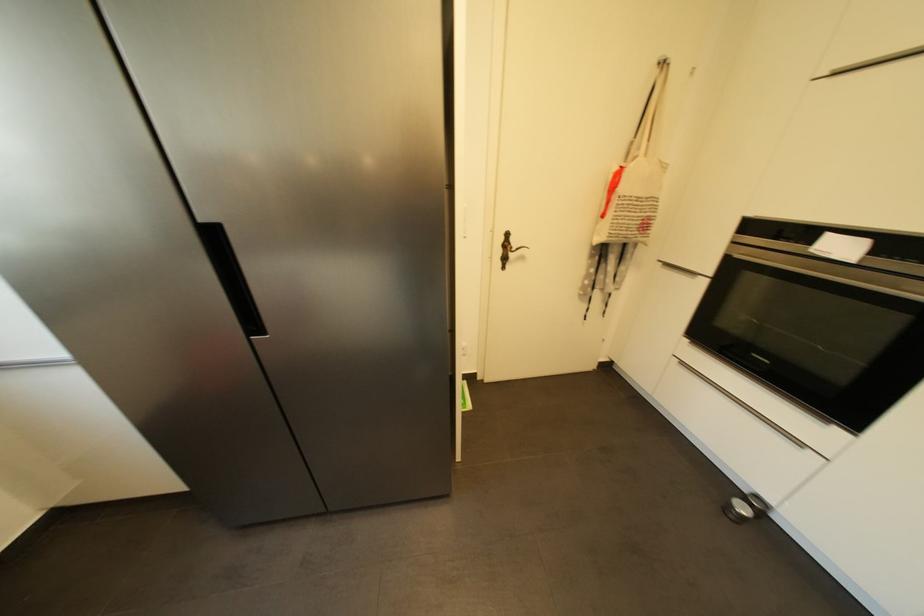
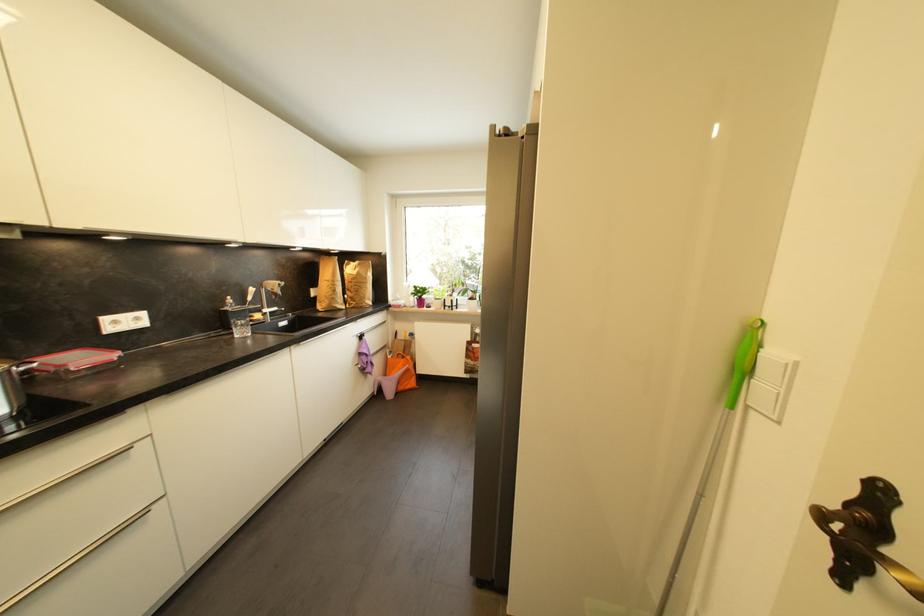
Where in the second image is the point corresponding to [508,270] from the first image?

(846, 581)